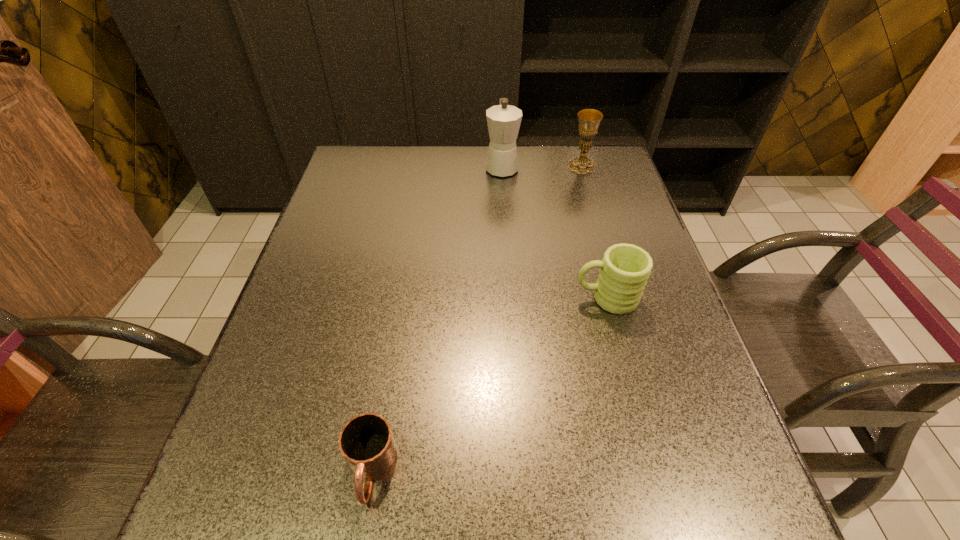
Where is `empty location between the leftmost object and the third shortest object`? empty location between the leftmost object and the third shortest object is located at coordinates (477, 319).

Where is `free space between the farther mug and the chalice`? free space between the farther mug and the chalice is located at coordinates (594, 232).

This screenshot has width=960, height=540. In order to click on vacant region between the second object from left to right and the left mug in this screenshot , I will do `click(437, 319)`.

Where is `vacant area that lies between the taller mug and the shorter mug`? The width and height of the screenshot is (960, 540). vacant area that lies between the taller mug and the shorter mug is located at coordinates (489, 384).

Where is `free space between the second object from left to right and the third shortest object`? free space between the second object from left to right and the third shortest object is located at coordinates (541, 167).

Identify which object is the closest to the second tallest object. Please provide its 2D coordinates. Your answer should be formatted as a tuple, i.e. [(x, y)], where the tuple contains the x and y coordinates of a point satisfying the conditions above.

[(503, 120)]

This screenshot has width=960, height=540. I want to click on object that is the second nearest to the third tallest object, so click(x=366, y=442).